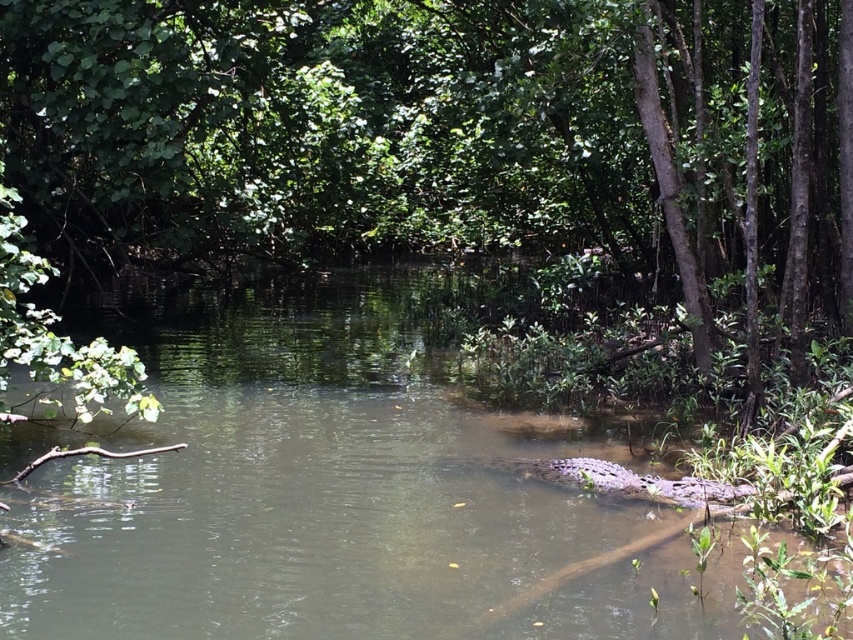
Based on the photo, who is more distant from viewer, (766, 36) or (416, 268)?

The point (416, 268) is more distant.

Is green leafy tree at center below brown muddy stream at center?

Incorrect, green leafy tree at center is not positioned below brown muddy stream at center.

This screenshot has height=640, width=853. Describe the element at coordinates (442, 138) in the screenshot. I see `green leafy tree at center` at that location.

Find the location of a particular element. This screenshot has width=853, height=640. green leafy tree at center is located at coordinates (442, 138).